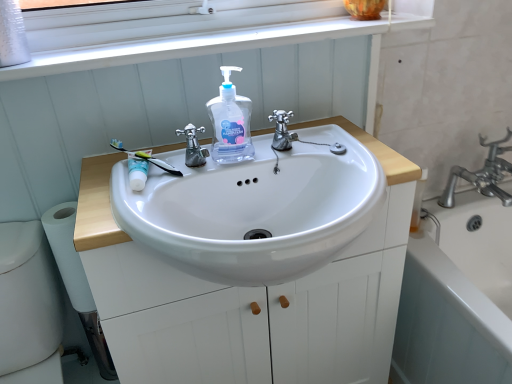
Identify the location of blank space to the left of green rubber toothbrush at upper left. (98, 171).